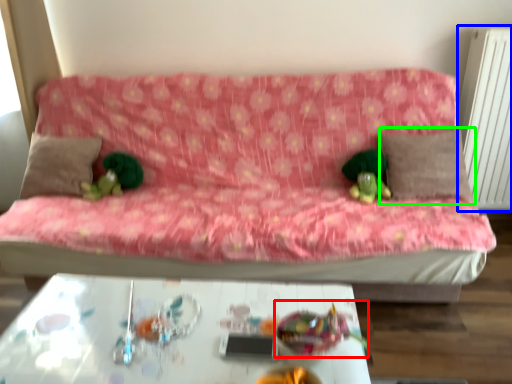
Question: Which is nearer to the toy (highlighted by a red box)? radiator (highlighted by a blue box) or pillow (highlighted by a green box).

Choices:
 (A) radiator
 (B) pillow

Answer: (B)